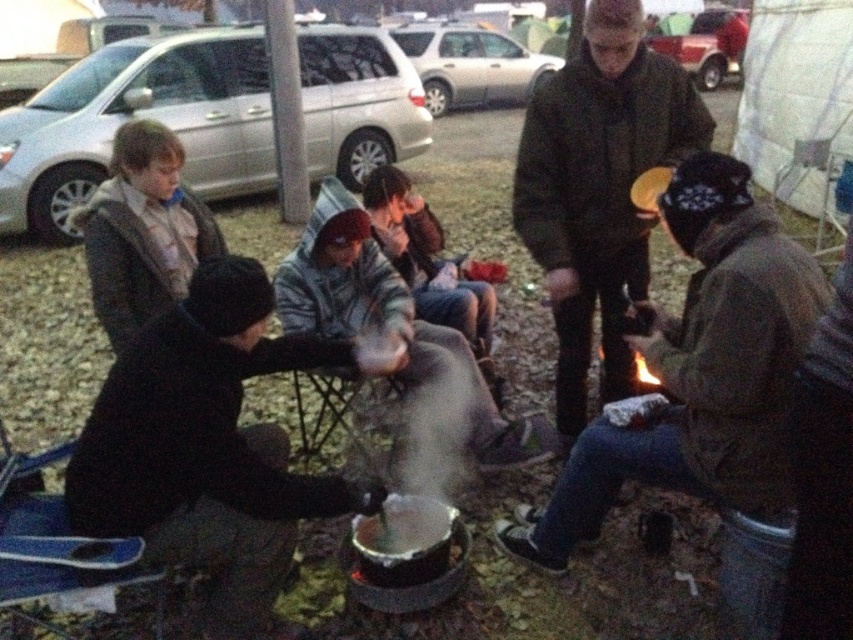
Question: Can you confirm if black matte pot at lower left is smaller than dark brown leather jacket at center?

Choices:
 (A) yes
 (B) no

Answer: (A)

Question: Can you confirm if black matte pot at lower left is positioned above dark brown leather jacket at center?

Choices:
 (A) yes
 (B) no

Answer: (B)

Question: Does black matte pot at lower left appear on the right side of dark brown leather jacket at center?

Choices:
 (A) no
 (B) yes

Answer: (A)

Question: Among these objects, which one is nearest to the camera?

Choices:
 (A) dark brown leather jacket at center
 (B) black matte pot at lower left

Answer: (B)

Question: Which of the following is the closest to the observer?

Choices:
 (A) dark brown leather jacket at center
 (B) black matte pot at lower left

Answer: (B)